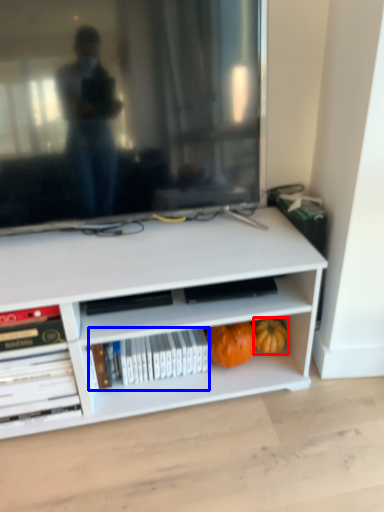
Question: Which object is closer to the camera taking this photo, pumpkin (highlighted by a red box) or book (highlighted by a blue box)?

Choices:
 (A) pumpkin
 (B) book

Answer: (B)